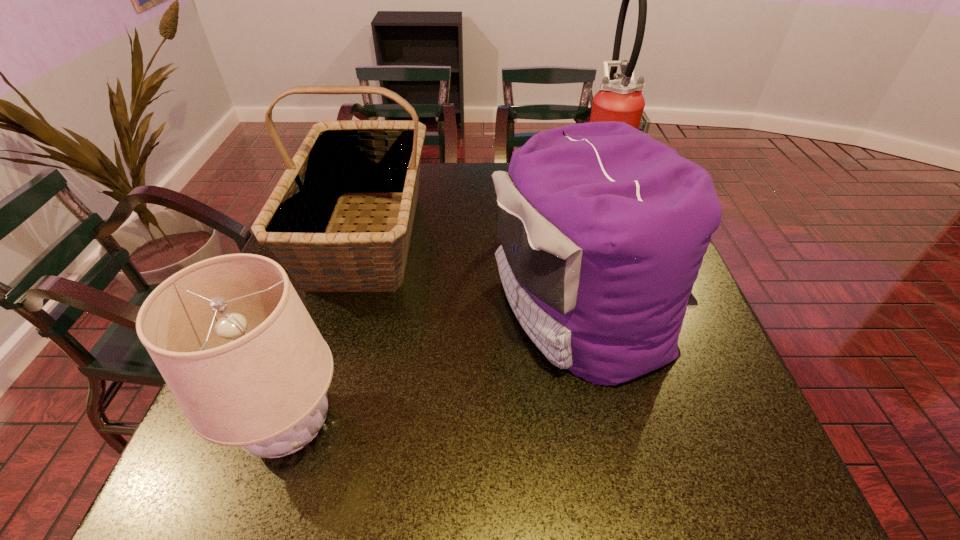
Identify the location of object that is at the near left corner. This screenshot has width=960, height=540. (236, 346).

Locate an element on the screen. object present at the far right corner is located at coordinates (621, 100).

The image size is (960, 540). In the image, there is a desktop. What are the coordinates of `blank space at the far edge` in the screenshot? It's located at (481, 188).

Image resolution: width=960 pixels, height=540 pixels. In the image, there is a desktop. In order to click on free region at the near edge in this screenshot , I will do `click(606, 492)`.

Image resolution: width=960 pixels, height=540 pixels. I want to click on free space at the left edge of the desktop, so click(x=304, y=304).

At what (x,y) coordinates should I click in order to perform the action: click on free region at the right edge of the desktop. Please return your answer as a coordinate pair (x, y). This screenshot has height=540, width=960. Looking at the image, I should click on (685, 353).

The image size is (960, 540). I want to click on free point between the basket and the lampshade, so click(x=328, y=330).

Locate an element on the screen. The height and width of the screenshot is (540, 960). vacant space that is in between the backpack and the lampshade is located at coordinates (437, 367).

At what (x,y) coordinates should I click in order to perform the action: click on blank region between the backpack and the basket. Please return your answer as a coordinate pair (x, y). The image size is (960, 540). Looking at the image, I should click on (476, 272).

Identify the location of vacant point located between the backpack and the basket. (476, 272).